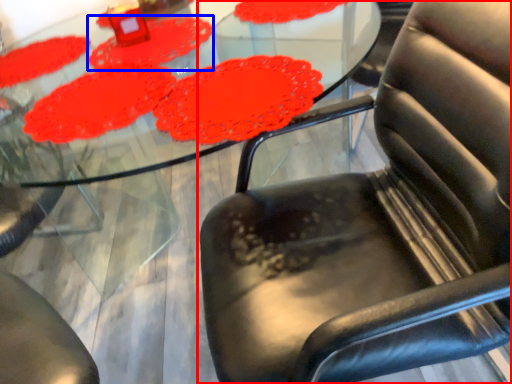
Question: Among these objects, which one is farthest to the camera, chair (highlighted by a red box) or mat (highlighted by a blue box)?

Choices:
 (A) chair
 (B) mat

Answer: (B)